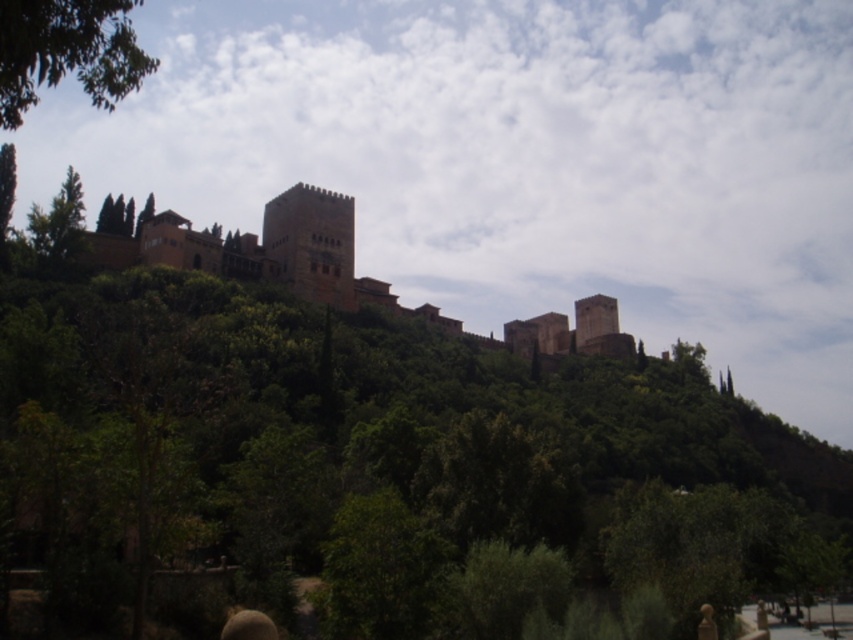
Which of these two, green leafy tree at upper left or green leafy tree at left, stands taller?

green leafy tree at upper left

Who is more forward, (119, 99) or (1, 192)?

Point (1, 192)

Find the location of a particular element. This screenshot has width=853, height=640. green leafy tree at upper left is located at coordinates (67, 51).

Does brown stone castle at center appear under green leafy tree at left?

Indeed, brown stone castle at center is positioned under green leafy tree at left.

Is point (444, 321) more distant than point (12, 157)?

That is True.

Where is `brown stone castle at center`? brown stone castle at center is located at coordinates (270, 252).

Is brown textured head at lower center to the right of green leafy tree at left from the viewer's perspective?

Yes, brown textured head at lower center is to the right of green leafy tree at left.

Measure the distance between brown textured head at lower center and camera.

166.88 feet

This screenshot has height=640, width=853. What are the coordinates of `brown textured head at lower center` in the screenshot? It's located at (248, 625).